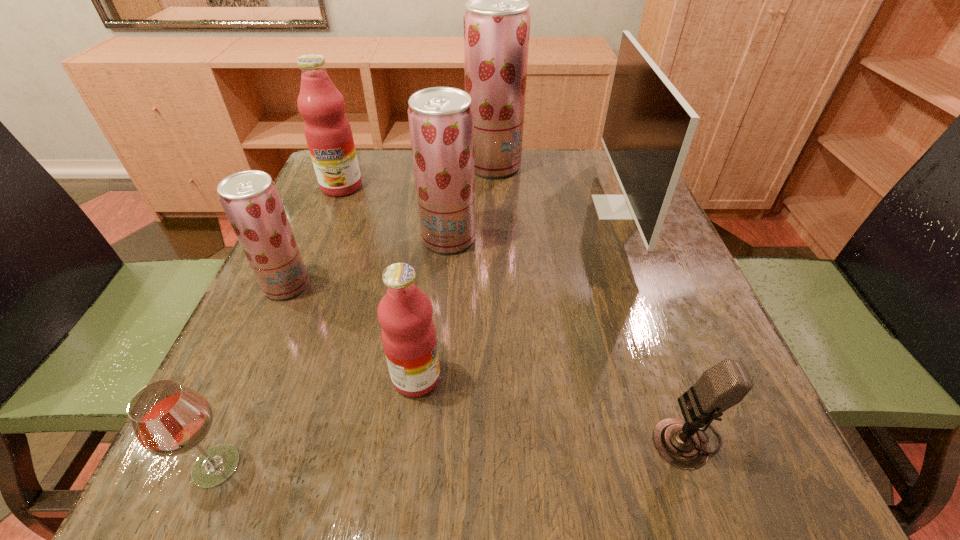
Locate which fruit juice ranks fifth in proximity to the microphone. Please provide its 2D coordinates. Your answer should be formatted as a tuple, i.e. [(x, y)], where the tuple contains the x and y coordinates of a point satisfying the conditions above.

[(328, 133)]

Image resolution: width=960 pixels, height=540 pixels. Find the location of `the third closest fruit juice relative to the sixth farthest object`. the third closest fruit juice relative to the sixth farthest object is located at coordinates (328, 133).

Identify the location of strawberry fruit juice that is the second closest to the tallest fruit juice. (250, 199).

Select which strawberry fruit juice is the second closest to the wineglass. Please provide its 2D coordinates. Your answer should be formatted as a tuple, i.e. [(x, y)], where the tuple contains the x and y coordinates of a point satisfying the conditions above.

[(441, 119)]

At what (x,y) coordinates should I click in order to perform the action: click on free space that satisfies the following two spatial constraints: 1. on the label of the second nearest strawberry fruit juice; 2. on the right side of the bigger pink fruit juice. Please return your answer as a coordinate pair (x, y). This screenshot has height=540, width=960. Looking at the image, I should click on (321, 238).

This screenshot has width=960, height=540. Find the location of `free location that satisfies the following two spatial constraints: 1. on the front-facing side of the microphone; 2. on the front side of the wineglass`. free location that satisfies the following two spatial constraints: 1. on the front-facing side of the microphone; 2. on the front side of the wineglass is located at coordinates (696, 466).